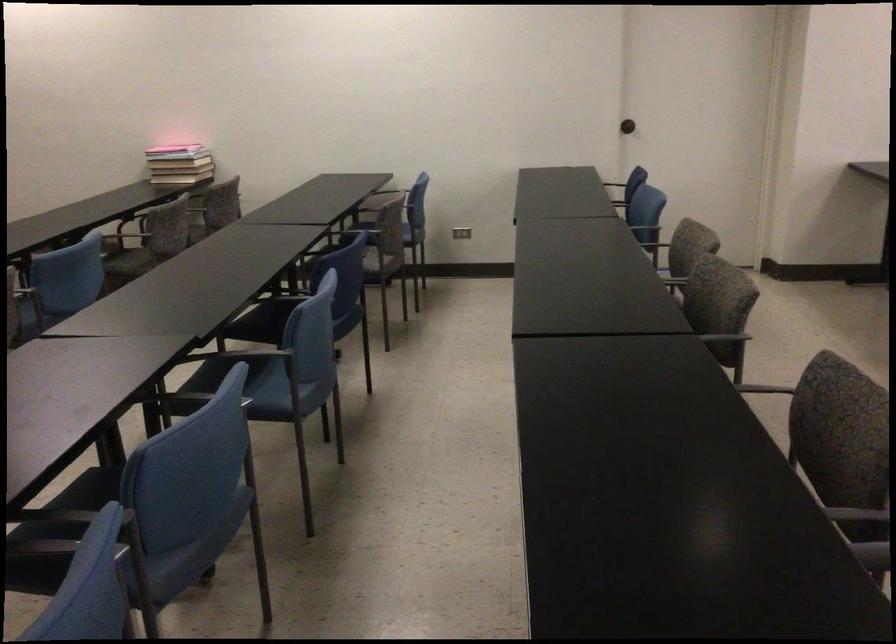
Where would you lift the tan book? Please return your answer as a coordinate pair (x, y).

(179, 169)